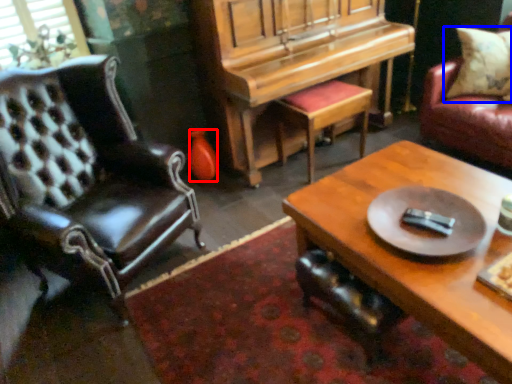
Question: Which point is closer to the camera, vase (highlighted by a red box) or pillow (highlighted by a blue box)?

Choices:
 (A) vase
 (B) pillow

Answer: (B)